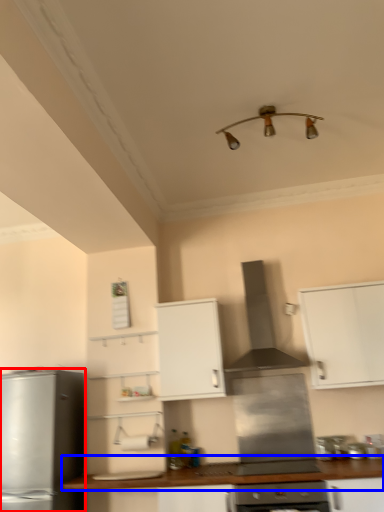
Question: Which of the following is the farthest to the observer, kitchen appliance (highlighted by a red box) or countertop (highlighted by a blue box)?

Choices:
 (A) kitchen appliance
 (B) countertop

Answer: (A)